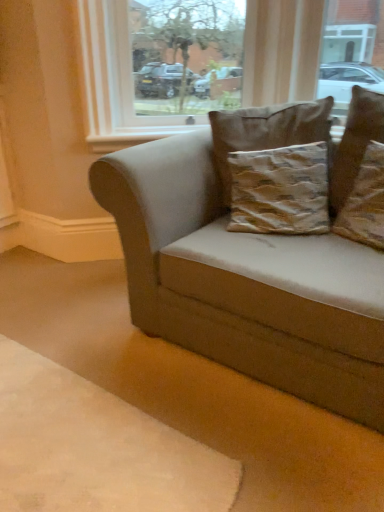
This screenshot has height=512, width=384. What do you see at coordinates (365, 202) in the screenshot?
I see `brown textured pillow at upper right, which ranks as the 1th pillow in right-to-left order` at bounding box center [365, 202].

What do you see at coordinates (96, 448) in the screenshot? I see `beige fabric dog bed at lower right` at bounding box center [96, 448].

Looking at this image, how much space does textured brown pillow at upper right, which is the 2th pillow in right-to-left order, occupy horizontally?

textured brown pillow at upper right, which is the 2th pillow in right-to-left order, is 4.57 inches in width.

Find the location of a particular element. The width and height of the screenshot is (384, 512). textured brown pillow at upper right, which ranks as the 2th pillow in left-to-right order is located at coordinates (355, 144).

Where is `brown textured cushion at center, which is the first pillow from left to right`? brown textured cushion at center, which is the first pillow from left to right is located at coordinates (267, 132).

Measure the distance between point (277, 142) and camera.

They are 1.81 meters apart.

What is the approximate height of suede beige couch at center?

77.15 centimeters.

This screenshot has height=512, width=384. I want to click on brown textured pillow at upper right, which is the third pillow from left to right, so click(x=365, y=202).

Find the location of `dog bed that appears in front of the brown textured pillow at upper right, which ranks as the 1th pillow in right-to-left order`. dog bed that appears in front of the brown textured pillow at upper right, which ranks as the 1th pillow in right-to-left order is located at coordinates (96, 448).

Are brown textured pillow at upper right, which ranks as the 1th pillow in right-to-left order, and beige fabric dog bed at lower right far apart?

brown textured pillow at upper right, which ranks as the 1th pillow in right-to-left order, is positioned a significant distance from beige fabric dog bed at lower right.

Is brown textured pillow at upper right, which ranks as the 1th pillow in right-to-left order, located outside beige fabric dog bed at lower right?

brown textured pillow at upper right, which ranks as the 1th pillow in right-to-left order, lies outside beige fabric dog bed at lower right's area.

From the image's perspective, which one is positioned lower, suede beige couch at center or brown textured pillow at upper right, which is the third pillow from left to right?

suede beige couch at center is shown below in the image.

From the suede beige couch at center, count 3rd pillow to the right and point to it. Please provide its 2D coordinates.

[(365, 202)]

Who is shorter, suede beige couch at center or brown textured pillow at upper right, which is the third pillow from left to right?

brown textured pillow at upper right, which is the third pillow from left to right.

Can you tell me how much suede beige couch at center and brown textured pillow at upper right, which is the third pillow from left to right, differ in facing direction?

17.3 degrees.

From the image's perspective, is brown textured cushion at center, which is the third pillow in right-to-left order, positioned above or below suede beige couch at center?

brown textured cushion at center, which is the third pillow in right-to-left order, is above suede beige couch at center.

Which is behind, point (314, 104) or point (202, 210)?

The point (202, 210) is farther from the camera.

Which of these two, brown textured cushion at center, which is the third pillow in right-to-left order, or suede beige couch at center, is smaller?

brown textured cushion at center, which is the third pillow in right-to-left order, is smaller.

At what (x,y) coordinates should I click in order to perform the action: click on studio couch located below the brown textured cushion at center, which is the first pillow from left to right (from the image's perspective). Please return your answer as a coordinate pair (x, y). The width and height of the screenshot is (384, 512). Looking at the image, I should click on (245, 281).

In the scene shown: Can you tell me how much beige fabric dog bed at lower right and brown textured pillow at upper right, which is the third pillow from left to right, differ in facing direction?

15.5 degrees separate the facing orientations of beige fabric dog bed at lower right and brown textured pillow at upper right, which is the third pillow from left to right.

Which of these two, beige fabric dog bed at lower right or brown textured pillow at upper right, which ranks as the 1th pillow in right-to-left order, is smaller?

Smaller between the two is brown textured pillow at upper right, which ranks as the 1th pillow in right-to-left order.

Would you consider beige fabric dog bed at lower right to be distant from brown textured pillow at upper right, which ranks as the 1th pillow in right-to-left order?

beige fabric dog bed at lower right is positioned a significant distance from brown textured pillow at upper right, which ranks as the 1th pillow in right-to-left order.

Considering the positions of points (160, 439) and (356, 223), is point (160, 439) farther from camera compared to point (356, 223)?

No, (160, 439) is in front of (356, 223).

Which is more to the right, textured brown pillow at upper right, which ranks as the 2th pillow in left-to-right order, or brown textured pillow at upper right, which ranks as the 1th pillow in right-to-left order?

From the viewer's perspective, brown textured pillow at upper right, which ranks as the 1th pillow in right-to-left order, appears more on the right side.

Is textured brown pillow at upper right, which ranks as the 2th pillow in left-to-right order, next to brown textured pillow at upper right, which is the third pillow from left to right?

textured brown pillow at upper right, which ranks as the 2th pillow in left-to-right order, is not next to brown textured pillow at upper right, which is the third pillow from left to right, and they're not touching.

Which is in front, point (378, 137) or point (379, 199)?

Positioned in front is point (379, 199).

Which object is closer to the camera, textured brown pillow at upper right, which is the 2th pillow in right-to-left order, or brown textured pillow at upper right, which is the third pillow from left to right?

brown textured pillow at upper right, which is the third pillow from left to right.

Which is farther from the camera, (376, 103) or (173, 160)?

The point (173, 160) is farther from the camera.

From a real-world perspective, between textured brown pillow at upper right, which is the 2th pillow in right-to-left order, and suede beige couch at center, who is vertically lower?

suede beige couch at center, from a real-world perspective.

From a real-world perspective, count 3rd pillows upward from the suede beige couch at center and point to it. Please provide its 2D coordinates.

[(355, 144)]

Which object is closer to the camera taking this photo, textured brown pillow at upper right, which ranks as the 2th pillow in left-to-right order, or suede beige couch at center?

suede beige couch at center.

From the image's perspective, is brown textured pillow at upper right, which is the third pillow from left to right, located above or below brown textured cushion at center, which is the third pillow in right-to-left order?

Clearly, from the image's perspective, brown textured pillow at upper right, which is the third pillow from left to right, is below brown textured cushion at center, which is the third pillow in right-to-left order.

From a real-world perspective, who is located higher, brown textured pillow at upper right, which ranks as the 1th pillow in right-to-left order, or brown textured cushion at center, which is the first pillow from left to right?

brown textured cushion at center, which is the first pillow from left to right.

Looking at this image, are brown textured pillow at upper right, which is the third pillow from left to right, and brown textured cushion at center, which is the first pillow from left to right, located far from each other?

No, brown textured pillow at upper right, which is the third pillow from left to right, is not far from brown textured cushion at center, which is the first pillow from left to right.

Identify the location of the 1st pillow above the beige fabric dog bed at lower right (from the image's perspective). (365, 202).

Locate an element on the screen. studio couch that appears in front of the brown textured pillow at upper right, which ranks as the 1th pillow in right-to-left order is located at coordinates (245, 281).

Looking at this image, considering their positions, is suede beige couch at center positioned further to transparent glass window at upper center than brown textured cushion at center, which is the first pillow from left to right?

suede beige couch at center is further to transparent glass window at upper center.

Based on their spatial positions, is textured brown pillow at upper right, which ranks as the 2th pillow in left-to-right order, or suede beige couch at center closer to brown textured pillow at upper right, which is the third pillow from left to right?

Based on the image, textured brown pillow at upper right, which ranks as the 2th pillow in left-to-right order, appears to be nearer to brown textured pillow at upper right, which is the third pillow from left to right.

Which object lies further to the anchor point textured brown pillow at upper right, which is the 2th pillow in right-to-left order, brown textured pillow at upper right, which is the third pillow from left to right, or suede beige couch at center?

suede beige couch at center lies further to textured brown pillow at upper right, which is the 2th pillow in right-to-left order, than the other object.

When comparing their distances from beige fabric dog bed at lower right, does transparent glass window at upper center or textured brown pillow at upper right, which ranks as the 2th pillow in left-to-right order, seem closer?

textured brown pillow at upper right, which ranks as the 2th pillow in left-to-right order, is positioned closer to the anchor beige fabric dog bed at lower right.

Based on their spatial positions, is textured brown pillow at upper right, which is the 2th pillow in right-to-left order, or beige fabric dog bed at lower right further from transparent glass window at upper center?

Among the two, beige fabric dog bed at lower right is located further to transparent glass window at upper center.

When comparing their distances from brown textured cushion at center, which is the first pillow from left to right, does textured brown pillow at upper right, which ranks as the 2th pillow in left-to-right order, or transparent glass window at upper center seem closer?

Among the two, textured brown pillow at upper right, which ranks as the 2th pillow in left-to-right order, is located nearer to brown textured cushion at center, which is the first pillow from left to right.

Considering their positions, is transparent glass window at upper center positioned closer to textured brown pillow at upper right, which is the 2th pillow in right-to-left order, than beige fabric dog bed at lower right?

Based on the image, transparent glass window at upper center appears to be nearer to textured brown pillow at upper right, which is the 2th pillow in right-to-left order.

Looking at this image, looking at the image, which one is located further to suede beige couch at center, textured brown pillow at upper right, which is the 2th pillow in right-to-left order, or transparent glass window at upper center?

transparent glass window at upper center is further to suede beige couch at center.

Where is `studio couch between brown textured cushion at center, which is the third pillow in right-to-left order, and beige fabric dog bed at lower right from top to bottom`? This screenshot has height=512, width=384. studio couch between brown textured cushion at center, which is the third pillow in right-to-left order, and beige fabric dog bed at lower right from top to bottom is located at coordinates (245, 281).

Identify the location of pillow located between beige fabric dog bed at lower right and textured brown pillow at upper right, which ranks as the 2th pillow in left-to-right order, in the left-right direction. Image resolution: width=384 pixels, height=512 pixels. (267, 132).

Where is `studio couch between beige fabric dog bed at lower right and textured brown pillow at upper right, which ranks as the 2th pillow in left-to-right order, from left to right`? This screenshot has width=384, height=512. studio couch between beige fabric dog bed at lower right and textured brown pillow at upper right, which ranks as the 2th pillow in left-to-right order, from left to right is located at coordinates coord(245,281).

This screenshot has width=384, height=512. In order to click on pillow between brown textured cushion at center, which is the third pillow in right-to-left order, and brown textured pillow at upper right, which is the third pillow from left to right in this screenshot , I will do `click(355, 144)`.